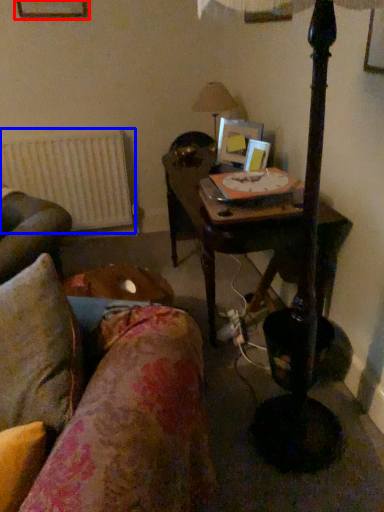
Question: Which point is closer to the camera, picture frame (highlighted by a red box) or radiator (highlighted by a blue box)?

Choices:
 (A) picture frame
 (B) radiator

Answer: (A)